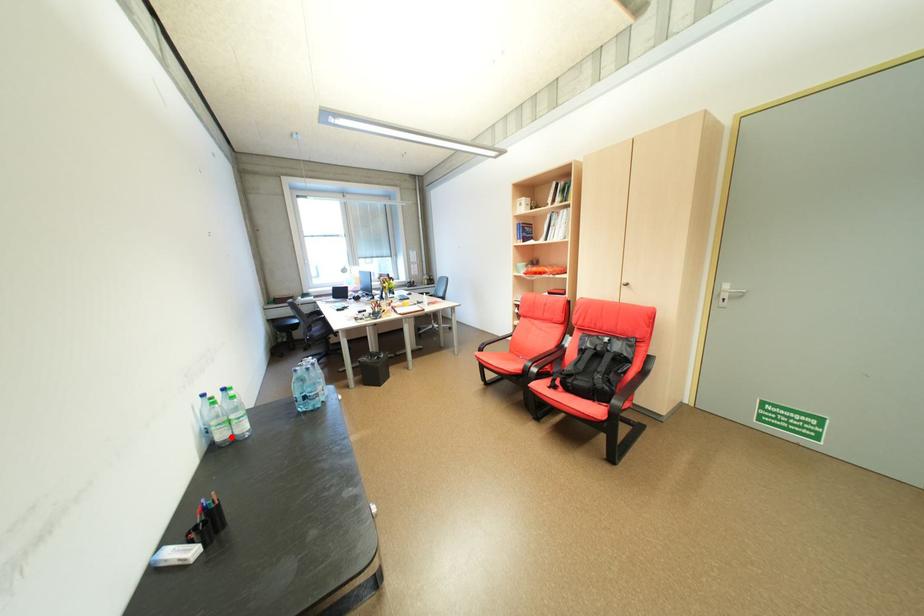
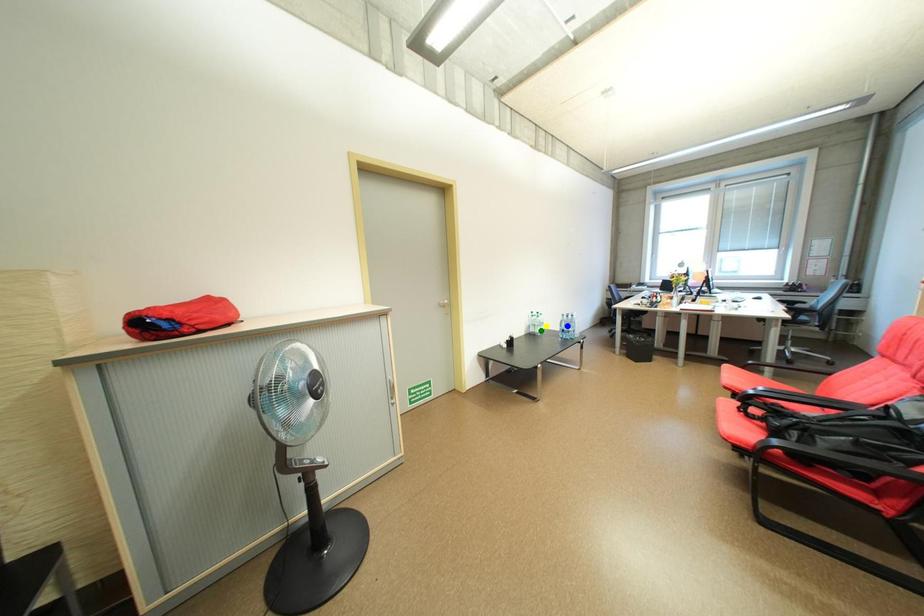
Question: I am providing you with two images of the same scene from different viewpoints. A red point is marked on the first image. You are given multiple points on the second image. Which spot in image 2 lines up with the point in image 1?

Choices:
 (A) blue point
 (B) yellow point
 (C) green point

Answer: (C)